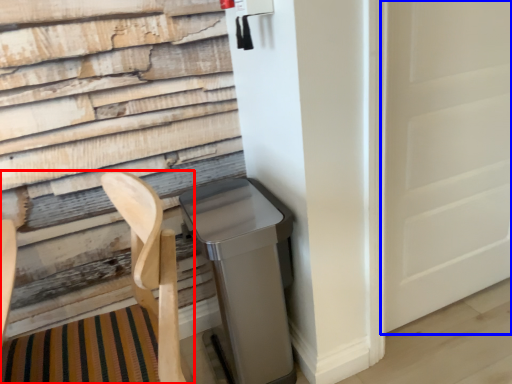
Question: Which point is further to the camera, folding chair (highlighted by a red box) or screen door (highlighted by a blue box)?

Choices:
 (A) folding chair
 (B) screen door

Answer: (B)